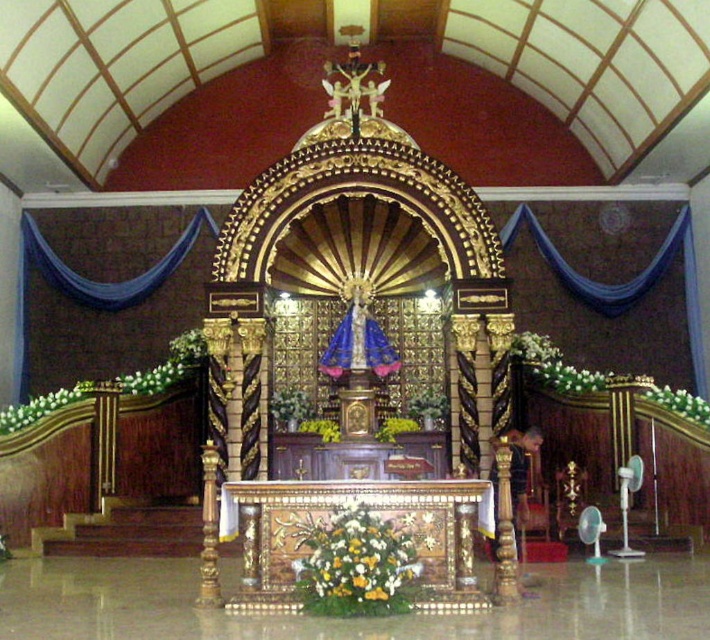
You are standing at the entrance of the church and want to locate two specific points in the altar area. The first point is at coordinate point(346, 544) and the second is at point(82, 396). Which point is closer to you?

Point(346, 544) is in front of point(82, 396), so the point(346, 544) is closer to you.

You are a visitor standing at the entrance of the church and want to place a small candle on the altar. The candle requires a space that is taller than the green leafy plant at right. Can you place it next to the white floral arrangement at lower left?

The white floral arrangement at lower left has a greater height compared to the green leafy plant at right. Since the candle requires a space taller than the green leafy plant at right, placing it next to the white floral arrangement at lower left would be suitable as it meets the height requirement.

You are a visitor standing at the entrance of the church and looking towards the altar. Which object, the wooden altar at center or the white floral arrangement at right, is positioned lower from your viewpoint?

The wooden altar at center is positioned lower than the white floral arrangement at right from your viewpoint.